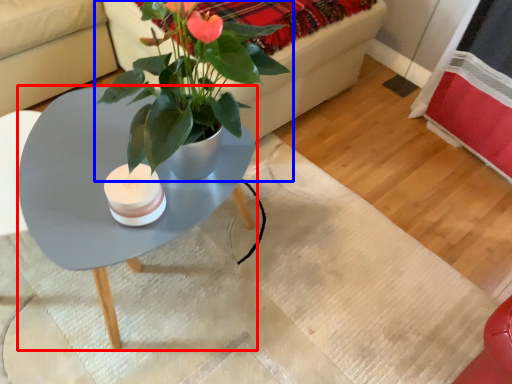
Question: Which object is closer to the camera taking this photo, coffee table (highlighted by a red box) or houseplant (highlighted by a blue box)?

Choices:
 (A) coffee table
 (B) houseplant

Answer: (A)